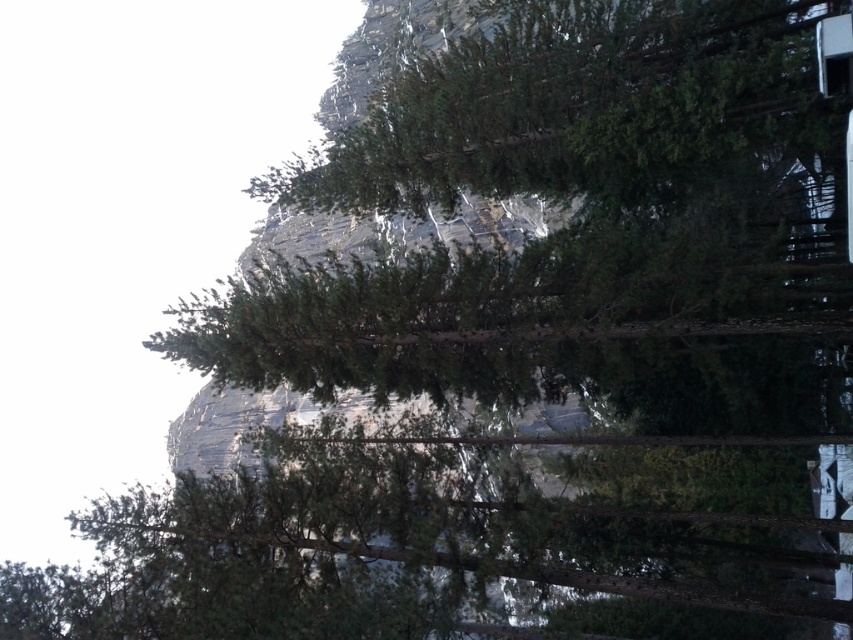
Does green matte tree at upper center have a lesser height compared to transparent glass train window at upper right?

In fact, green matte tree at upper center may be taller than transparent glass train window at upper right.

Is point (532, 115) positioned after point (817, 74)?

Yes.

Measure the distance between green matte tree at upper center and camera.

123.24 feet

At what (x,y) coordinates should I click in order to perform the action: click on green matte tree at upper center. Please return your answer as a coordinate pair (x, y). Looking at the image, I should click on (572, 104).